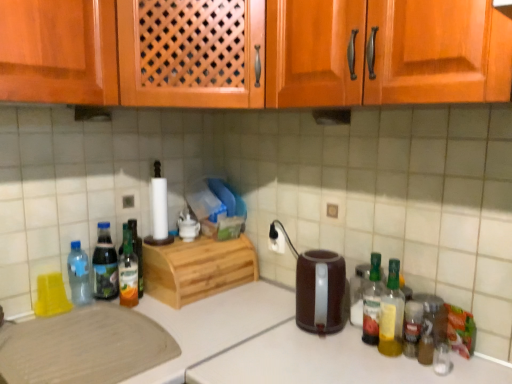
The height and width of the screenshot is (384, 512). Identify the location of natural wood breadbox at center, placed as the 2th cabinetry when sorted from top to bottom. (197, 268).

Where is `light brown wood cutting board at lower left`? light brown wood cutting board at lower left is located at coordinates (84, 347).

What is the approximate height of light brown wood cutting board at lower left?

The height of light brown wood cutting board at lower left is 20.69 centimeters.

What do you see at coordinates (317, 287) in the screenshot?
I see `brown plastic kettle at center` at bounding box center [317, 287].

Describe the element at coordinates (128, 271) in the screenshot. I see `translucent glass bottle at center left, which is the 4th bottle from right to left` at that location.

You are a GUI agent. You are given a task and a screenshot of the screen. Output one action in this format:
    pyautogui.click(x=<x>, y=<y>)
    Task: Click on the translucent glass bottle at right, arranged as the 5th bottle when viewed from the left
    The width and height of the screenshot is (512, 384).
    Given the screenshot: What is the action you would take?
    pyautogui.click(x=392, y=314)

How different are the orientations of translucent plastic bottle at left, which is counted as the 5th bottle, starting from the right, and wooden cabinet at upper center, which ranks as the 1th cabinetry in top-to-bottom order, in degrees?

The facing directions of translucent plastic bottle at left, which is counted as the 5th bottle, starting from the right, and wooden cabinet at upper center, which ranks as the 1th cabinetry in top-to-bottom order, are 45.2 degrees apart.

From the image's perspective, between translucent plastic bottle at left, which ranks as the second bottle in left-to-right order, and wooden cabinet at upper center, which ranks as the 1th cabinetry in top-to-bottom order, which one is located above?

wooden cabinet at upper center, which ranks as the 1th cabinetry in top-to-bottom order, is shown above in the image.

Is point (110, 266) positioned before point (406, 1)?

No, it is behind (406, 1).

From a real-world perspective, is translucent plastic bottle at left, which is counted as the 5th bottle, starting from the right, over wooden cabinet at upper center, the 2th cabinetry positioned from the bottom?

No, from a real-world perspective, translucent plastic bottle at left, which is counted as the 5th bottle, starting from the right, is not over wooden cabinet at upper center, the 2th cabinetry positioned from the bottom

Is translucent glass bottle at right, which is counted as the fourth bottle, starting from the left, oriented away from translucent plastic bottle at right, the first bottle when ordered from right to left?

That's not correct — translucent glass bottle at right, which is counted as the fourth bottle, starting from the left, is not looking away from translucent plastic bottle at right, the first bottle when ordered from right to left.

Is translucent glass bottle at right, which is counted as the fourth bottle, starting from the left, completely or partially outside of translucent plastic bottle at right, the sixth bottle viewed from the left?

Yes.

Is translucent glass bottle at right, which is counted as the fourth bottle, starting from the left, with translucent plastic bottle at right, the sixth bottle viewed from the left?

No, translucent glass bottle at right, which is counted as the fourth bottle, starting from the left, is not with translucent plastic bottle at right, the sixth bottle viewed from the left.

Does translucent glass bottle at right, the third bottle from the right, have a lesser width compared to translucent plastic bottle at right, the first bottle when ordered from right to left?

Indeed, translucent glass bottle at right, the third bottle from the right, has a lesser width compared to translucent plastic bottle at right, the first bottle when ordered from right to left.

Between transparent plastic bottle at left, which ranks as the 1th bottle in left-to-right order, and translucent glass bottle at right, arranged as the 2th bottle when viewed from the right, which one appears on the left side from the viewer's perspective?

From the viewer's perspective, transparent plastic bottle at left, which ranks as the 1th bottle in left-to-right order, appears more on the left side.

Looking at this image, from a real-world perspective, is transparent plastic bottle at left, the sixth bottle when ordered from right to left, positioned under translucent glass bottle at right, arranged as the 2th bottle when viewed from the right, based on gravity?

Yes, from a real-world perspective, transparent plastic bottle at left, the sixth bottle when ordered from right to left, is under translucent glass bottle at right, arranged as the 2th bottle when viewed from the right.

Is transparent plastic bottle at left, the sixth bottle when ordered from right to left, facing towards translucent glass bottle at right, arranged as the 2th bottle when viewed from the right?

No, transparent plastic bottle at left, the sixth bottle when ordered from right to left, is not turned towards translucent glass bottle at right, arranged as the 2th bottle when viewed from the right.

Which of these two, transparent plastic bottle at left, the sixth bottle when ordered from right to left, or translucent glass bottle at right, arranged as the 5th bottle when viewed from the left, is smaller?

Smaller between the two is translucent glass bottle at right, arranged as the 5th bottle when viewed from the left.

Considering their positions, is transparent plastic bottle at left, the sixth bottle when ordered from right to left, located in front of or behind translucent glass bottle at right, the third bottle from the right?

Clearly, transparent plastic bottle at left, the sixth bottle when ordered from right to left, is behind translucent glass bottle at right, the third bottle from the right.

Does transparent plastic bottle at left, the sixth bottle when ordered from right to left, turn towards translucent glass bottle at right, which is counted as the fourth bottle, starting from the left?

No, transparent plastic bottle at left, the sixth bottle when ordered from right to left, is not oriented towards translucent glass bottle at right, which is counted as the fourth bottle, starting from the left.

Can you tell me how much transparent plastic bottle at left, which ranks as the 1th bottle in left-to-right order, and translucent glass bottle at right, which is counted as the fourth bottle, starting from the left, differ in facing direction?

transparent plastic bottle at left, which ranks as the 1th bottle in left-to-right order, and translucent glass bottle at right, which is counted as the fourth bottle, starting from the left, are facing 90 degrees away from each other.

From the image's perspective, is transparent plastic bottle at left, the sixth bottle when ordered from right to left, over translucent glass bottle at right, which is counted as the fourth bottle, starting from the left?

Correct, transparent plastic bottle at left, the sixth bottle when ordered from right to left, appears higher than translucent glass bottle at right, which is counted as the fourth bottle, starting from the left, in the image.

Identify the location of the 1st bottle above the brown plastic kettle at center (from the image's perspective). This screenshot has width=512, height=384. (372, 302).

Would you say translucent glass bottle at right, the third bottle from the right, contains brown plastic kettle at center?

→ No, brown plastic kettle at center is not surrounded by translucent glass bottle at right, the third bottle from the right.

Is point (371, 287) positioned in front of point (329, 307)?

That is False.

Which object is thinner, translucent glass bottle at right, the third bottle from the right, or brown plastic kettle at center?

Thinner between the two is translucent glass bottle at right, the third bottle from the right.

From a real-world perspective, between brown plastic kettle at center and translucent plastic bottle at right, the first bottle when ordered from right to left, who is vertically higher?

In real-world perspective, brown plastic kettle at center is above.

Which object is closer to the camera taking this photo, brown plastic kettle at center or translucent plastic bottle at right, the first bottle when ordered from right to left?

translucent plastic bottle at right, the first bottle when ordered from right to left, is more forward.

Considering the sizes of objects brown plastic kettle at center and translucent plastic bottle at right, the first bottle when ordered from right to left, in the image provided, who is smaller, brown plastic kettle at center or translucent plastic bottle at right, the first bottle when ordered from right to left,?

Smaller between the two is translucent plastic bottle at right, the first bottle when ordered from right to left.

Visually, is brown plastic kettle at center positioned to the left or to the right of translucent plastic bottle at right, the first bottle when ordered from right to left?

brown plastic kettle at center is positioned on translucent plastic bottle at right, the first bottle when ordered from right to left,'s left side.

Which is more to the right, light brown wood cutting board at lower left or translucent plastic bottle at right, the first bottle when ordered from right to left?

translucent plastic bottle at right, the first bottle when ordered from right to left, is more to the right.

Consider the image. Is light brown wood cutting board at lower left facing towards translucent plastic bottle at right, the sixth bottle viewed from the left?

No, light brown wood cutting board at lower left does not turn towards translucent plastic bottle at right, the sixth bottle viewed from the left.

Looking at this image, considering the sizes of light brown wood cutting board at lower left and translucent plastic bottle at right, the sixth bottle viewed from the left, in the image, is light brown wood cutting board at lower left taller or shorter than translucent plastic bottle at right, the sixth bottle viewed from the left,?

Considering their sizes, light brown wood cutting board at lower left has more height than translucent plastic bottle at right, the sixth bottle viewed from the left.

From the translucent plastic bottle at left, which is counted as the 5th bottle, starting from the right, count 2nd cabinetrys forward and point to it. Please provide its 2D coordinates.

[(428, 50)]

Which bottle is the 2nd one when counting from the right side of the translucent glass bottle at right, which is counted as the fourth bottle, starting from the left? Please provide its 2D coordinates.

[(412, 328)]

Considering their positions, is transparent plastic bottle at left, the sixth bottle when ordered from right to left, positioned closer to translucent plastic bottle at right, the first bottle when ordered from right to left, than brown plastic kettle at center?

brown plastic kettle at center lies closer to translucent plastic bottle at right, the first bottle when ordered from right to left, than the other object.

When comparing their distances from brown plastic kettle at center, does natural wood breadbox at center, placed as the 2th cabinetry when sorted from top to bottom, or light brown wood cutting board at lower left seem further?

The object further to brown plastic kettle at center is light brown wood cutting board at lower left.

Which object lies nearer to the anchor point translucent plastic bottle at left, which ranks as the second bottle in left-to-right order, translucent glass bottle at center left, which is counted as the third bottle, starting from the left, or translucent glass bottle at right, the third bottle from the right?

Among the two, translucent glass bottle at center left, which is counted as the third bottle, starting from the left, is located nearer to translucent plastic bottle at left, which ranks as the second bottle in left-to-right order.

Looking at the image, which one is located further to brown plastic kettle at center, translucent glass bottle at right, which is counted as the fourth bottle, starting from the left, or transparent plastic bottle at left, which ranks as the 1th bottle in left-to-right order?

Based on the image, transparent plastic bottle at left, which ranks as the 1th bottle in left-to-right order, appears to be further to brown plastic kettle at center.

From the image, which object appears to be nearer to translucent glass bottle at right, which is counted as the fourth bottle, starting from the left, translucent glass bottle at center left, which is counted as the third bottle, starting from the left, or brown plastic kettle at center?

brown plastic kettle at center.

When comparing their distances from translucent glass bottle at right, the third bottle from the right, does wooden cabinet at upper center, the 2th cabinetry positioned from the bottom, or light brown wood cutting board at lower left seem further?

Based on the image, light brown wood cutting board at lower left appears to be further to translucent glass bottle at right, the third bottle from the right.

In the scene shown: Based on their spatial positions, is natural wood breadbox at center, placed as the 2th cabinetry when sorted from top to bottom, or translucent glass bottle at right, arranged as the 5th bottle when viewed from the left, closer to brown plastic kettle at center?

Based on the image, translucent glass bottle at right, arranged as the 5th bottle when viewed from the left, appears to be nearer to brown plastic kettle at center.

When comparing their distances from wooden cabinet at upper center, the 2th cabinetry positioned from the bottom, does transparent plastic bottle at left, the sixth bottle when ordered from right to left, or translucent plastic bottle at left, which is counted as the 5th bottle, starting from the right, seem further?

Based on the image, transparent plastic bottle at left, the sixth bottle when ordered from right to left, appears to be further to wooden cabinet at upper center, the 2th cabinetry positioned from the bottom.

The height and width of the screenshot is (384, 512). I want to click on appliance between translucent glass bottle at center left, which is the 4th bottle from right to left, and translucent glass bottle at right, arranged as the 5th bottle when viewed from the left, so click(317, 287).

Where is `appliance between transparent plastic bottle at left, the sixth bottle when ordered from right to left, and translucent glass bottle at right, the third bottle from the right`? Image resolution: width=512 pixels, height=384 pixels. appliance between transparent plastic bottle at left, the sixth bottle when ordered from right to left, and translucent glass bottle at right, the third bottle from the right is located at coordinates (317, 287).

The image size is (512, 384). I want to click on cabinetry between wooden cabinet at upper center, the 2th cabinetry positioned from the bottom, and transparent plastic bottle at left, the sixth bottle when ordered from right to left, vertically, so click(x=197, y=268).

This screenshot has height=384, width=512. What are the coordinates of `appliance situated between natural wood breadbox at center, acting as the first cabinetry starting from the bottom, and translucent glass bottle at right, which is counted as the fourth bottle, starting from the left, from left to right` in the screenshot? It's located at (317, 287).